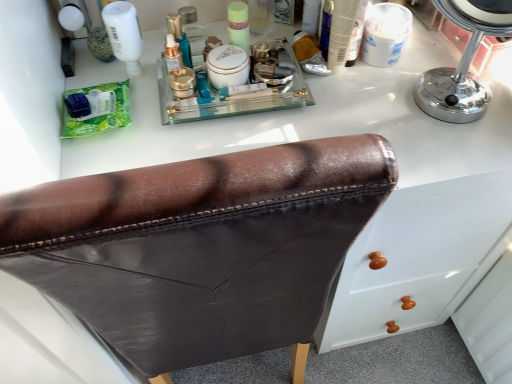
Locate an element on the screen. This screenshot has width=512, height=384. free space between chrome/metallic mirror at upper right and green matte packet at left is located at coordinates (271, 118).